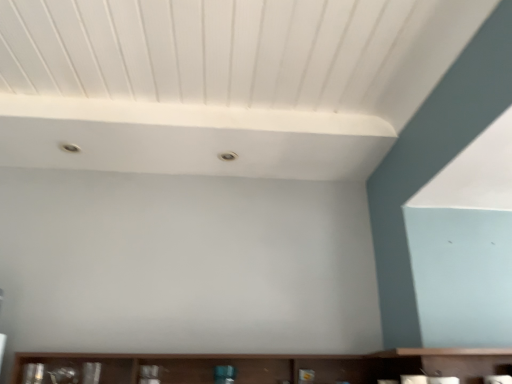
Locate an element on the screen. The width and height of the screenshot is (512, 384). brown wooden shelf at lower center is located at coordinates (286, 365).

What do you see at coordinates (286, 365) in the screenshot? I see `brown wooden shelf at lower center` at bounding box center [286, 365].

Locate an element on the screen. This screenshot has width=512, height=384. brown wooden shelf at lower center is located at coordinates 286,365.